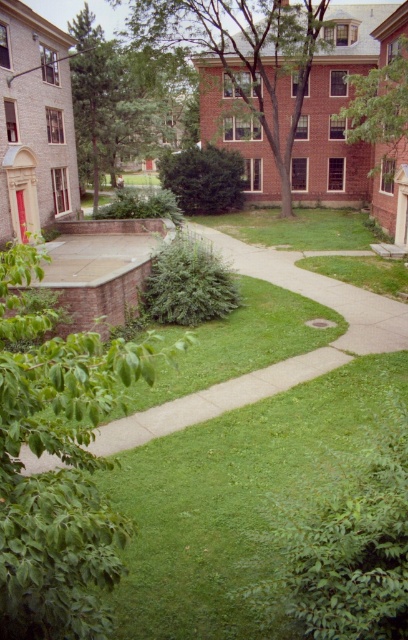
You are a student carrying a heavy backpack and need to walk from the green leafy tree at lower left to the red door on the building in the midground. The path between them is 6.49 feet wide. If your backpack is 2 feet wide, can you walk through the path safely without hitting the sides?

The path between the green leafy tree at lower left and the red door on the building in the midground is 6.49 feet wide. Since your backpack is only 2 feet wide, there will be plenty of space to walk through safely without hitting the sides.

You are a student walking along the curved concrete pathway in the foreground of the campus courtyard. You want to find the thinnest tree to rest under. Which tree should you choose between the green leafy tree at lower left and the green leafy tree at center?

The green leafy tree at lower left is thinner than the green leafy tree at center, so you should choose the green leafy tree at lower left to rest under.